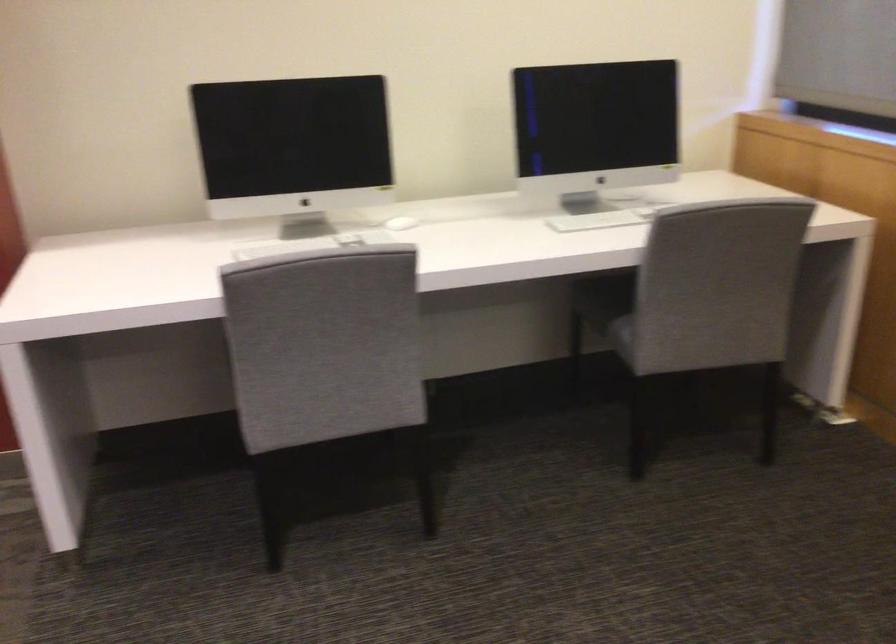
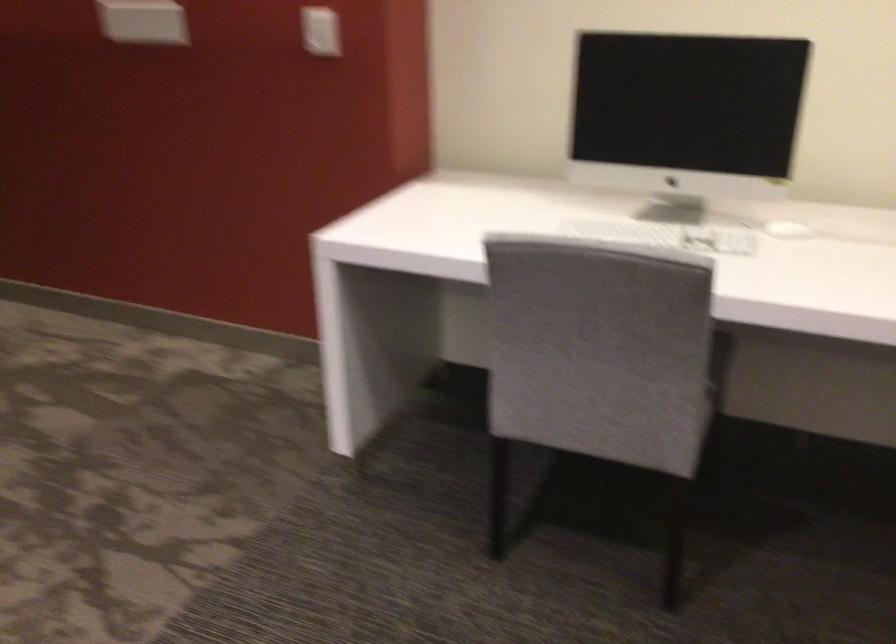
In the second image, find the point that corresponds to (x=409, y=223) in the first image.

(786, 230)